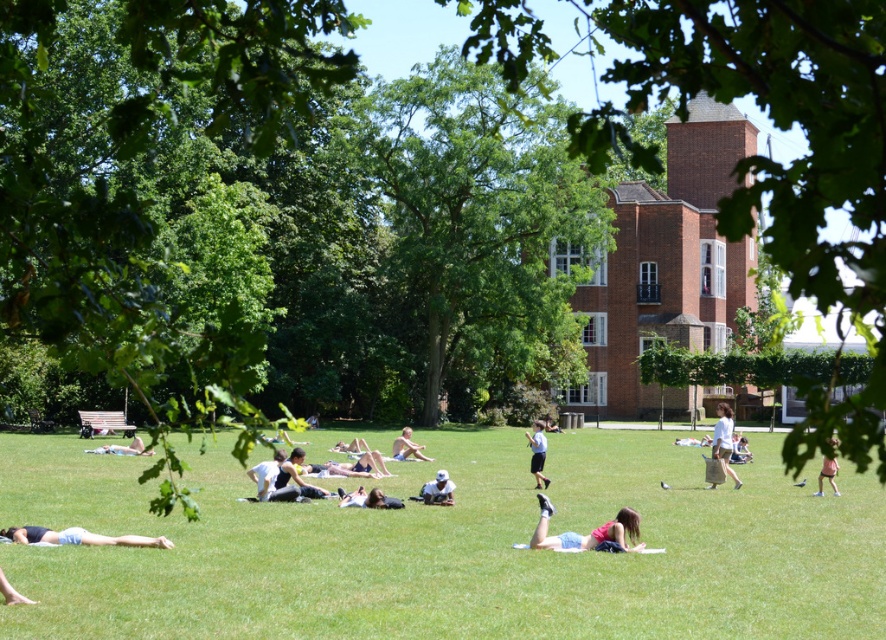
Describe the element at coordinates (587, 534) in the screenshot. I see `pink fabric at center` at that location.

Can you confirm if pink fabric at center is thinner than light brown wooden bench at center?

Indeed, pink fabric at center has a lesser width compared to light brown wooden bench at center.

Is point (634, 529) in front of point (395, 444)?

Yes.

What are the coordinates of `pink fabric at center` in the screenshot? It's located at (587, 534).

Is matte black shorts at lower left to the right of dark gray fabric at center from the viewer's perspective?

No, matte black shorts at lower left is not to the right of dark gray fabric at center.

Does point (78, 538) come behind point (278, 472)?

No, it is in front of (278, 472).

What are the coordinates of `matte black shorts at lower left` in the screenshot? It's located at (79, 536).

Who is more forward, (799, 106) or (612, 529)?

Positioned in front is point (799, 106).

Is point (825, 60) closer to viewer compared to point (587, 548)?

Yes, it is in front of point (587, 548).

The width and height of the screenshot is (886, 640). I want to click on green leafy tree at center, so click(x=791, y=160).